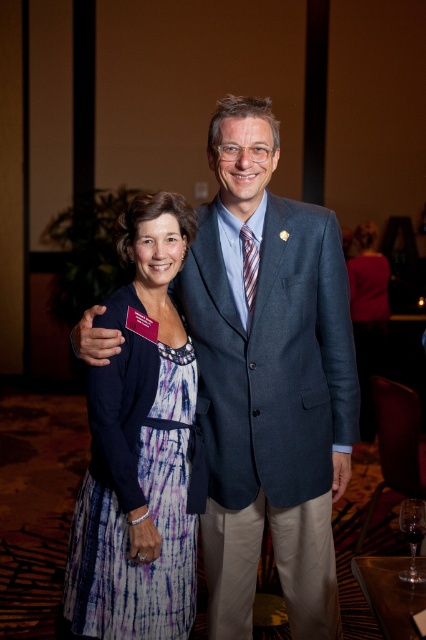
Question: Observing the image, what is the correct spatial positioning of purple tie-dye dress at center in reference to striped silk tie at center?

Choices:
 (A) left
 (B) right

Answer: (A)

Question: Which object appears farthest from the camera in this image?

Choices:
 (A) striped silk tie at center
 (B) transparent glass at center
 (C) purple tie-dye dress at center

Answer: (A)

Question: Which point is closer to the camera?

Choices:
 (A) silky purple dress at right
 (B) transparent glass at center
 (C) blue textured suit at center
 (D) striped silk tie at center

Answer: (B)

Question: Which point is farther to the camera?

Choices:
 (A) (104, 412)
 (B) (236, 212)

Answer: (B)

Question: Does purple tie-dye dress at center have a smaller size compared to silky purple dress at right?

Choices:
 (A) yes
 (B) no

Answer: (A)

Question: Considering the relative positions of purple tie-dye dress at center and striped silk tie at center in the image provided, where is purple tie-dye dress at center located with respect to striped silk tie at center?

Choices:
 (A) right
 (B) left

Answer: (B)